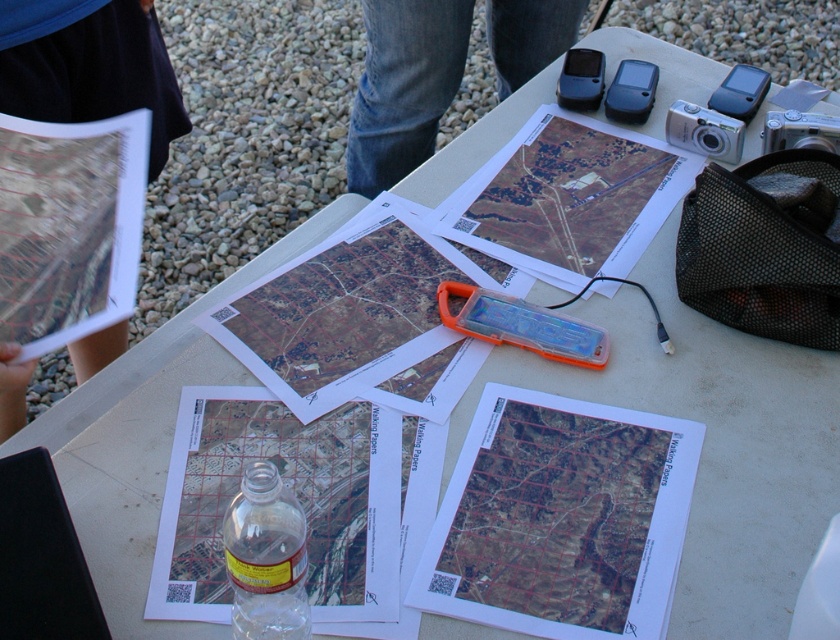
You are a hiker preparing for a trail and see the black fabric map at upper left and the clear plastic bottle at center on the table. Which item is positioned more to the left?

The black fabric map at upper left is positioned more to the left than the clear plastic bottle at center.

You are a hiker who needs to locate your position on the map. You see the black fabric map at upper left and the jeans at center on the table. Which object is closer to the edge of the table?

The black fabric map at upper left is closer to the edge of the table because it is positioned below the jeans at center, meaning it is located lower on the table surface.